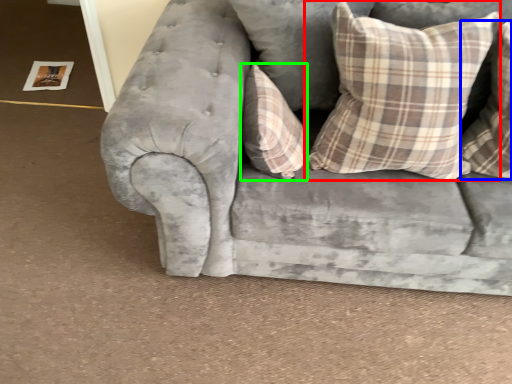
Question: Considering the real-world distances, which object is farthest from pillow (highlighted by a red box)? pillow (highlighted by a blue box) or pillow (highlighted by a green box)?

Choices:
 (A) pillow
 (B) pillow

Answer: (B)